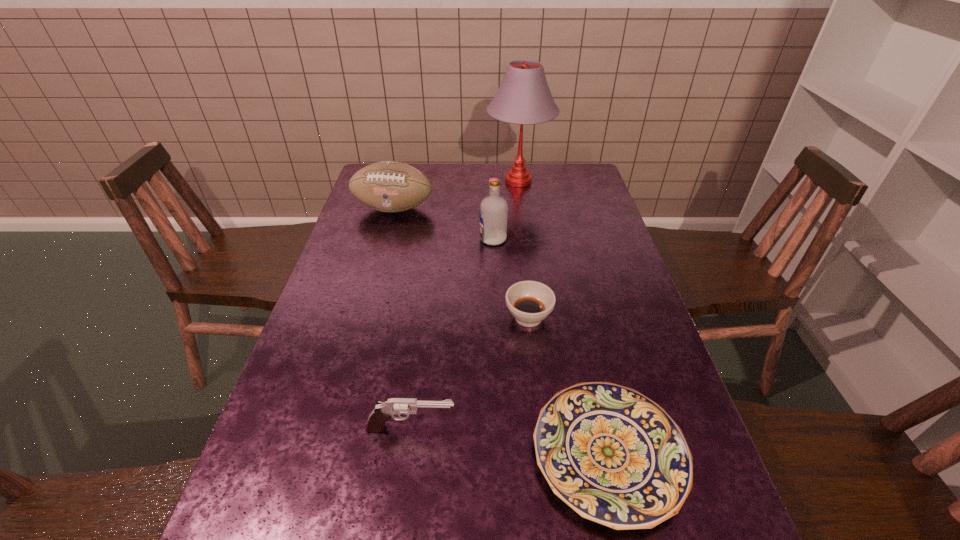
Image resolution: width=960 pixels, height=540 pixels. I want to click on free space located on the front-facing side of the tallest object, so click(378, 181).

The width and height of the screenshot is (960, 540). Identify the location of vacant space located on the label of the third farthest object. (386, 239).

Image resolution: width=960 pixels, height=540 pixels. Identify the location of blank area located on the label of the third farthest object. (450, 239).

This screenshot has height=540, width=960. I want to click on free space located on the label of the third farthest object, so click(x=373, y=239).

The width and height of the screenshot is (960, 540). I want to click on free point located on the laces of the fourth shortest object, so click(x=368, y=302).

Identify the location of vacant space situated 0.080m at the muzzle of the third shortest object. (495, 429).

Find the location of `vacant region located on the right of the fourth farthest object`. vacant region located on the right of the fourth farthest object is located at coordinates (615, 318).

The height and width of the screenshot is (540, 960). What are the coordinates of `vacant space located 0.050m on the left of the plate` in the screenshot? It's located at 507,454.

In order to click on object located in the far edge section of the desktop in this screenshot , I will do `click(524, 97)`.

What are the coordinates of `object that is positioned at the left edge` in the screenshot? It's located at (388, 186).